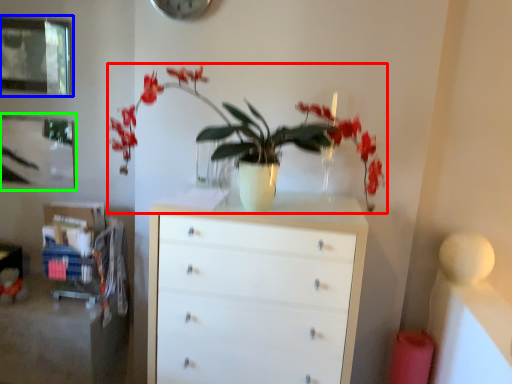
Question: Based on their relative distances, which object is farther from houseplant (highlighted by a red box)? Choose from picture frame (highlighted by a blue box) and picture frame (highlighted by a green box).

Choices:
 (A) picture frame
 (B) picture frame

Answer: (A)